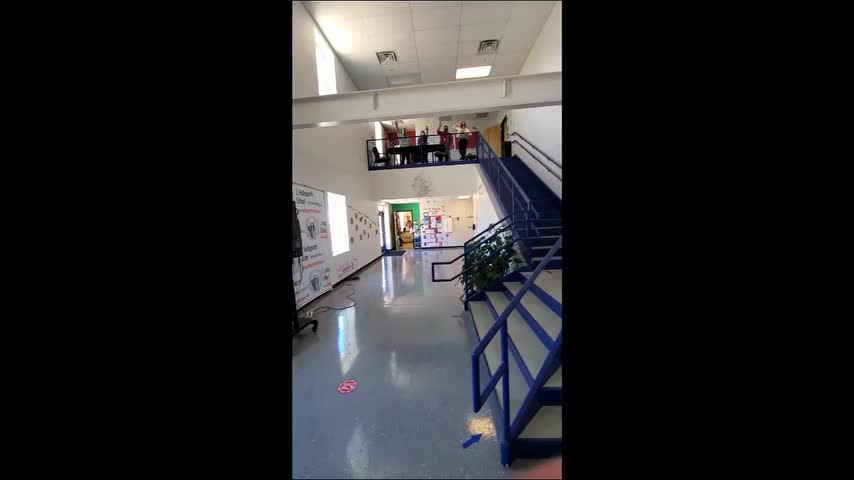
At what (x,y) coordinates should I click in order to perform the action: click on stair handrail. Please return your answer as a coordinate pair (x, y). The height and width of the screenshot is (480, 854). Looking at the image, I should click on (531, 278), (498, 232), (502, 216), (521, 191), (534, 158), (540, 152), (430, 134).